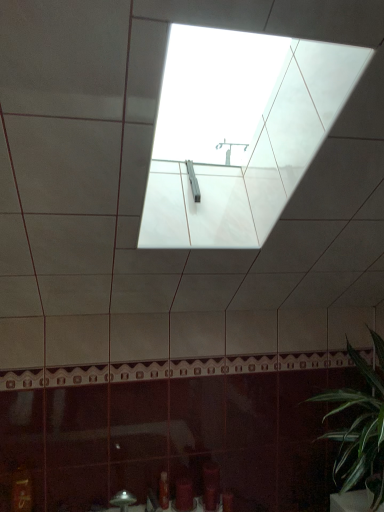
Question: Does matte red toiletry at lower center, the 1th toiletry from the right, come behind green leafy plant at lower right?

Choices:
 (A) no
 (B) yes

Answer: (B)

Question: From the image's perspective, is matte red toiletry at lower center, arranged as the second toiletry when viewed from the left, beneath green leafy plant at lower right?

Choices:
 (A) no
 (B) yes

Answer: (B)

Question: Is matte red toiletry at lower center, the 1th toiletry from the right, in front of green leafy plant at lower right?

Choices:
 (A) no
 (B) yes

Answer: (A)

Question: Does matte red toiletry at lower center, arranged as the second toiletry when viewed from the left, have a greater height compared to green leafy plant at lower right?

Choices:
 (A) yes
 (B) no

Answer: (B)

Question: Can you confirm if matte red toiletry at lower center, arranged as the second toiletry when viewed from the left, is smaller than green leafy plant at lower right?

Choices:
 (A) yes
 (B) no

Answer: (A)

Question: Visually, is green leafy plant at lower right positioned to the left or to the right of matte red toiletry at lower center, arranged as the second toiletry when viewed from the left?

Choices:
 (A) right
 (B) left

Answer: (A)

Question: In terms of height, does green leafy plant at lower right look taller or shorter compared to matte red toiletry at lower center, the 1th toiletry from the right?

Choices:
 (A) short
 (B) tall

Answer: (B)

Question: Is point (x=372, y=415) closer or farther from the camera than point (x=188, y=489)?

Choices:
 (A) closer
 (B) farther

Answer: (A)

Question: Is green leafy plant at lower right wider or thinner than matte red toiletry at lower center, the 1th toiletry from the right?

Choices:
 (A) wide
 (B) thin

Answer: (A)

Question: Considering their positions, is green leafy plant at lower right located in front of or behind translucent plastic bottle at lower center, positioned as the 2th toiletry in right-to-left order?

Choices:
 (A) behind
 (B) front

Answer: (B)

Question: In the image, is green leafy plant at lower right on the left side or the right side of translucent plastic bottle at lower center, positioned as the 2th toiletry in right-to-left order?

Choices:
 (A) left
 (B) right

Answer: (B)

Question: From their relative heights in the image, would you say green leafy plant at lower right is taller or shorter than translucent plastic bottle at lower center, acting as the 1th toiletry starting from the left?

Choices:
 (A) short
 (B) tall

Answer: (B)

Question: Looking at their shapes, would you say green leafy plant at lower right is wider or thinner than translucent plastic bottle at lower center, positioned as the 2th toiletry in right-to-left order?

Choices:
 (A) thin
 (B) wide

Answer: (B)

Question: From a real-world perspective, is translucent plastic bottle at lower center, positioned as the 2th toiletry in right-to-left order, positioned above or below matte red toiletry at lower center, the 1th toiletry from the right?

Choices:
 (A) below
 (B) above

Answer: (B)

Question: Is translucent plastic bottle at lower center, positioned as the 2th toiletry in right-to-left order, taller or shorter than matte red toiletry at lower center, the 1th toiletry from the right?

Choices:
 (A) short
 (B) tall

Answer: (B)